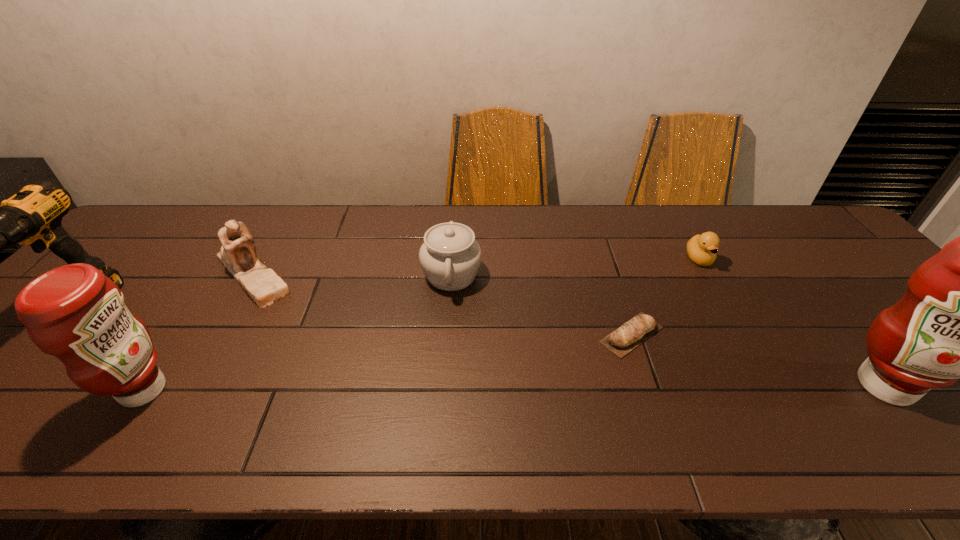
Please point a space for a new condiment to maintain equal intervals. Please provide its 2D coordinates. Your answer should be formatted as a tuple, i.e. [(x, y)], where the tuple contains the x and y coordinates of a point satisfying the conditions above.

[(516, 388)]